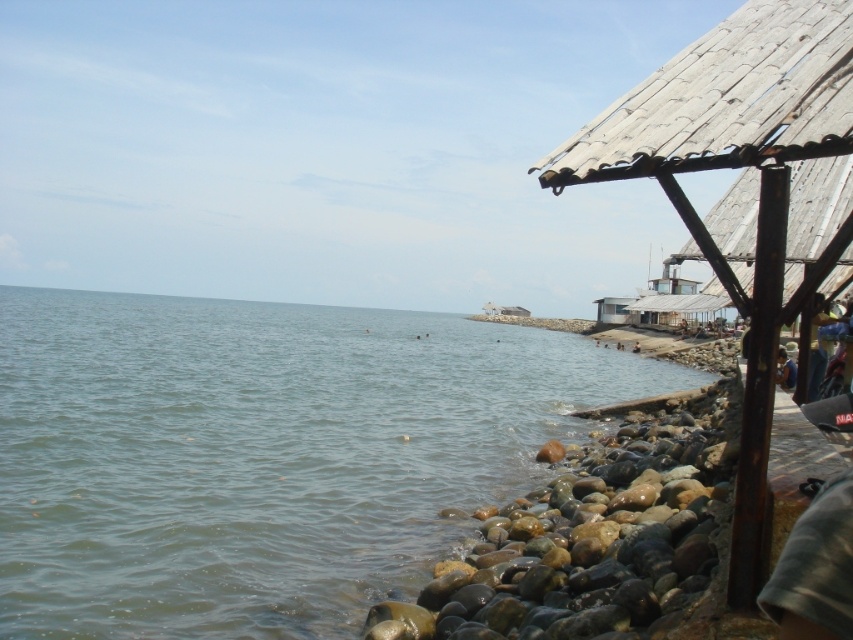
Does clear water at lower left have a lesser height compared to dark blue fabric at lower right?

No.

Measure the distance from clear water at lower left to dark blue fabric at lower right.

The distance of clear water at lower left from dark blue fabric at lower right is 44.93 meters.

Locate an element on the screen. The height and width of the screenshot is (640, 853). clear water at lower left is located at coordinates (263, 456).

You are a GUI agent. You are given a task and a screenshot of the screen. Output one action in this format:
    pyautogui.click(x=<x>, y=<y>)
    Task: Click on the clear water at lower left
    This screenshot has height=640, width=853.
    Given the screenshot: What is the action you would take?
    pyautogui.click(x=263, y=456)

Is clear water at lower left to the left of rusty metallic rocks at lower right from the viewer's perspective?

Yes, clear water at lower left is to the left of rusty metallic rocks at lower right.

Does point (289, 403) come behind point (601, 460)?

Yes, point (289, 403) is behind point (601, 460).

Locate an element on the screen. This screenshot has width=853, height=640. clear water at lower left is located at coordinates (263, 456).

Measure the distance between clear water at lower left and rusty metal roof at right.

clear water at lower left and rusty metal roof at right are 135.21 feet apart from each other.

Does point (126, 472) come farther from viewer compared to point (752, 579)?

Yes, it is behind point (752, 579).

Identify the location of clear water at lower left. The image size is (853, 640). (263, 456).